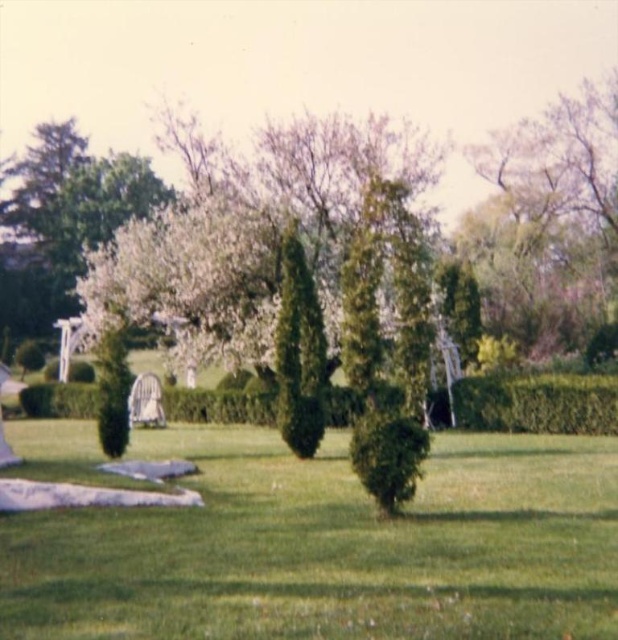
Question: Among these points, which one is nearest to the camera?

Choices:
 (A) (577, 401)
 (B) (588, 168)

Answer: (A)

Question: Observing the image, what is the correct spatial positioning of green leafy tree at upper right in reference to green leafy hedge at center?

Choices:
 (A) left
 (B) right

Answer: (B)

Question: Does green leafy tree at upper right appear under green leafy hedge at center?

Choices:
 (A) no
 (B) yes

Answer: (A)

Question: Is green leafy tree at upper right to the right of green leafy hedge at center from the viewer's perspective?

Choices:
 (A) yes
 (B) no

Answer: (A)